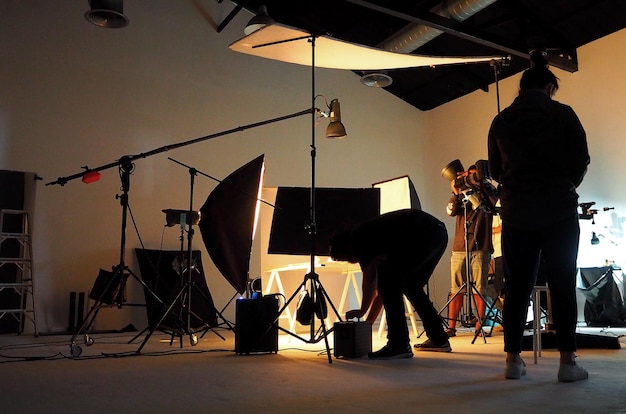
At what (x,y) coordinates should I click in order to perform the action: click on light reflector sheet. Please return your answer as a coordinate pair (x, y). This screenshot has height=414, width=626. Looking at the image, I should click on (342, 57).